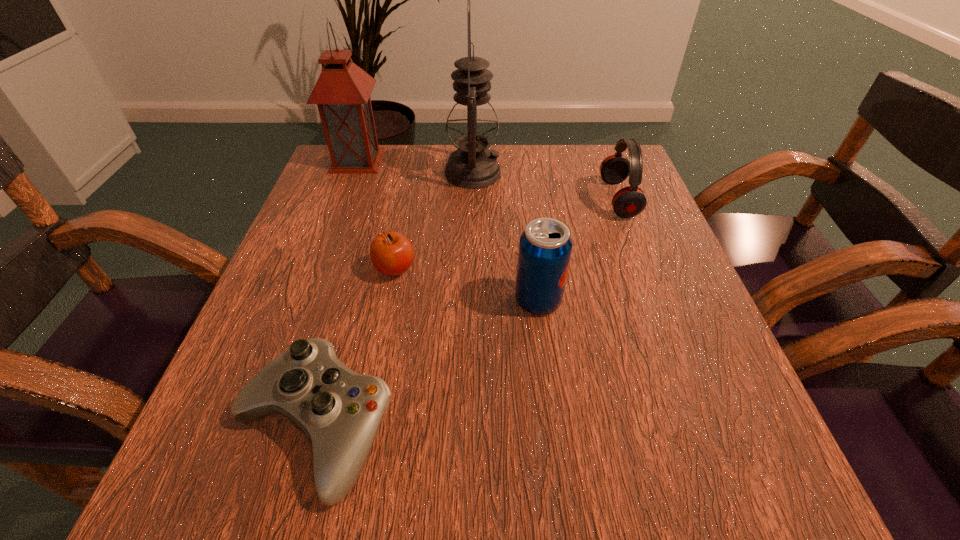
The width and height of the screenshot is (960, 540). In order to click on vacant space at the near right corner in this screenshot , I will do `click(736, 474)`.

Identify the location of unoccupied area between the apple and the lantern. (376, 215).

The image size is (960, 540). Find the location of `free spot between the second object from right to left and the rightmost object`. free spot between the second object from right to left and the rightmost object is located at coordinates (578, 249).

The width and height of the screenshot is (960, 540). In order to click on empty space between the fifth object from left to right and the apple in this screenshot , I will do `click(467, 285)`.

You are a GUI agent. You are given a task and a screenshot of the screen. Output one action in this format:
    pyautogui.click(x=<x>, y=<y>)
    Task: Click on the empty space between the fifth object from left to right and the apple
    This screenshot has width=960, height=540.
    Given the screenshot: What is the action you would take?
    pyautogui.click(x=467, y=285)

The width and height of the screenshot is (960, 540). I want to click on free space between the earphone and the control, so click(467, 313).

The image size is (960, 540). Identify the location of vacant point located between the apple and the second tallest object. (376, 215).

This screenshot has width=960, height=540. I want to click on unoccupied position between the apple and the rightmost object, so click(507, 234).

Identify the location of free spot between the apple and the oil lamp. (434, 221).

Locate an element on the screen. The image size is (960, 540). free space between the rightmost object and the tallest object is located at coordinates (545, 186).